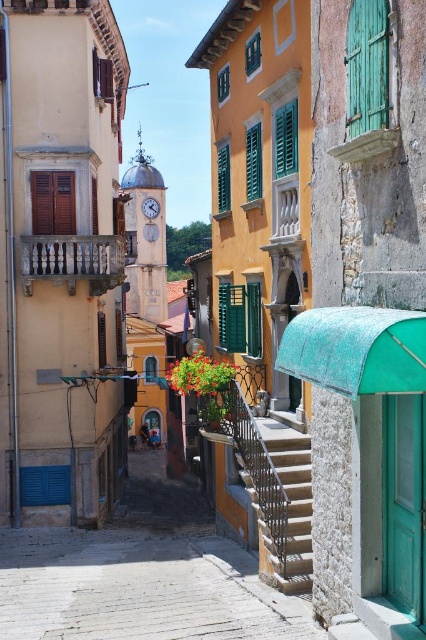
Between smooth stone steps at center and green matte shutter at upper center, which one appears on the right side from the viewer's perspective?

From the viewer's perspective, green matte shutter at upper center appears more on the right side.

Is point (129, 595) farther from viewer compared to point (230, 170)?

That is False.

Identify the location of smooth stone steps at center. (141, 576).

Can you confirm if smooth stone steps at center is positioned above green matte shutters at center?

Incorrect, smooth stone steps at center is not positioned above green matte shutters at center.

Can you confirm if smooth stone steps at center is smaller than green matte shutters at center?

No, smooth stone steps at center is not smaller than green matte shutters at center.

Between point (89, 556) and point (253, 125), which one is positioned in front?

Point (253, 125) is in front.

The height and width of the screenshot is (640, 426). I want to click on smooth stone steps at center, so click(141, 576).

Can you confirm if green wooden shutter at upper right is wider than green matte shutters at center?

Incorrect, green wooden shutter at upper right's width does not surpass green matte shutters at center's.

The height and width of the screenshot is (640, 426). Identify the location of green wooden shutter at upper right. (367, 67).

What do you see at coordinates (367, 67) in the screenshot? I see `green wooden shutter at upper right` at bounding box center [367, 67].

Locate an element on the screen. Image resolution: width=426 pixels, height=640 pixels. green wooden shutter at upper right is located at coordinates (367, 67).